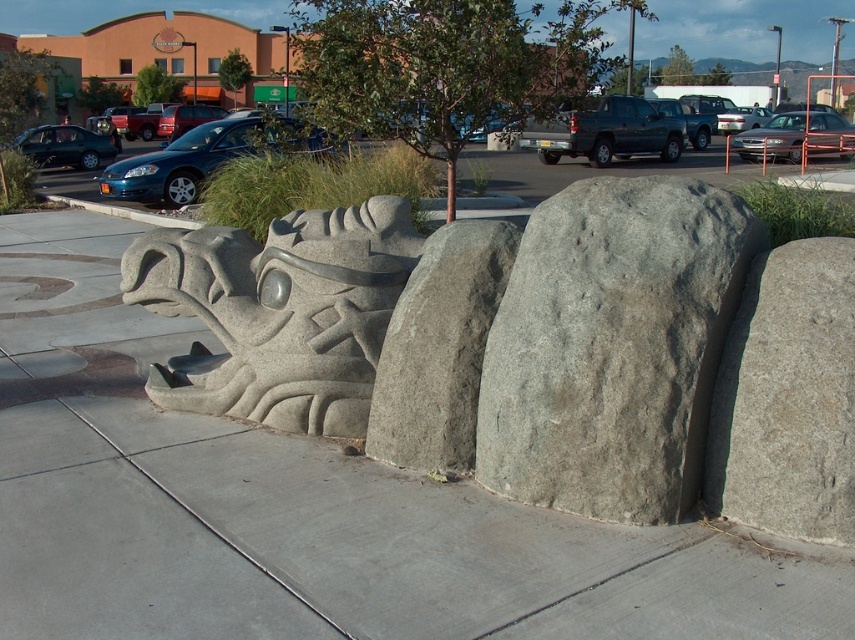
Question: Which point is closer to the camera?

Choices:
 (A) (432, 563)
 (B) (74, 182)
 (C) (470, 445)

Answer: (A)

Question: Based on their relative distances, which object is nearer to the gray stone dragon at center?

Choices:
 (A) gray concrete curb at lower left
 (B) gray stone boulder at center-right

Answer: (B)

Question: Does gray concrete pavement at center appear over gray rough stone boulder at center?

Choices:
 (A) yes
 (B) no

Answer: (B)

Question: Does gray concrete pavement at center have a larger size compared to gray stone boulder at center-right?

Choices:
 (A) no
 (B) yes

Answer: (A)

Question: Which object appears closest to the camera in this image?

Choices:
 (A) gray stone boulder at center
 (B) gray concrete pavement at center
 (C) gray concrete curb at lower left

Answer: (B)

Question: From the image, what is the correct spatial relationship of gray concrete pavement at center in relation to gray concrete curb at lower left?

Choices:
 (A) below
 (B) above

Answer: (A)